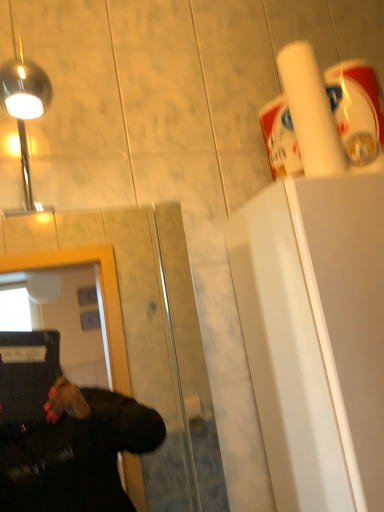
Question: Is transparent glass door at center looking in the opposite direction of polished chrome light at upper left?

Choices:
 (A) yes
 (B) no

Answer: (B)

Question: From the image's perspective, would you say transparent glass door at center is positioned over polished chrome light at upper left?

Choices:
 (A) yes
 (B) no

Answer: (B)

Question: Considering the relative positions of transparent glass door at center and polished chrome light at upper left in the image provided, is transparent glass door at center to the left of polished chrome light at upper left from the viewer's perspective?

Choices:
 (A) yes
 (B) no

Answer: (B)

Question: Is polished chrome light at upper left located within transparent glass door at center?

Choices:
 (A) no
 (B) yes

Answer: (A)

Question: Is transparent glass door at center oriented towards polished chrome light at upper left?

Choices:
 (A) no
 (B) yes

Answer: (A)

Question: From a real-world perspective, is transparent glass door at center positioned above or below polished chrome light at upper left?

Choices:
 (A) above
 (B) below

Answer: (B)

Question: Does point (168, 265) appear closer or farther from the camera than point (26, 159)?

Choices:
 (A) farther
 (B) closer

Answer: (A)

Question: In terms of size, does transparent glass door at center appear bigger or smaller than polished chrome light at upper left?

Choices:
 (A) small
 (B) big

Answer: (B)

Question: In the image, is transparent glass door at center on the left side or the right side of polished chrome light at upper left?

Choices:
 (A) left
 (B) right

Answer: (B)

Question: Is transparent glass door at center wider or thinner than white matte paper towel at upper right?

Choices:
 (A) wide
 (B) thin

Answer: (A)

Question: Is transparent glass door at center inside or outside of white matte paper towel at upper right?

Choices:
 (A) inside
 (B) outside

Answer: (B)

Question: From their relative heights in the image, would you say transparent glass door at center is taller or shorter than white matte paper towel at upper right?

Choices:
 (A) short
 (B) tall

Answer: (B)

Question: Would you say transparent glass door at center is to the left or to the right of white matte paper towel at upper right in the picture?

Choices:
 (A) right
 (B) left

Answer: (B)

Question: In terms of size, does white matte paper towel at upper right appear bigger or smaller than polished chrome light at upper left?

Choices:
 (A) small
 (B) big

Answer: (A)

Question: From a real-world perspective, is white matte paper towel at upper right physically located above or below polished chrome light at upper left?

Choices:
 (A) below
 (B) above

Answer: (B)